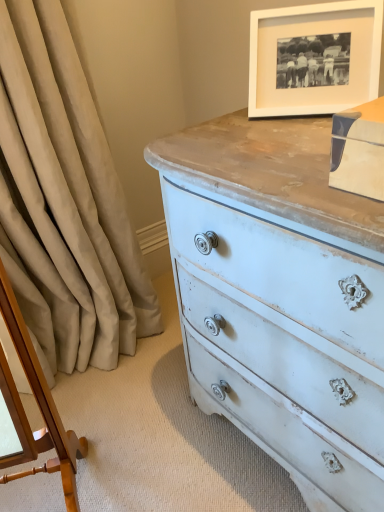
Question: Considering the relative sizes of beige fabric curtain at left and wooden changing table at left in the image provided, is beige fabric curtain at left wider than wooden changing table at left?

Choices:
 (A) no
 (B) yes

Answer: (B)

Question: Considering the relative positions of beige fabric curtain at left and wooden changing table at left in the image provided, is beige fabric curtain at left behind wooden changing table at left?

Choices:
 (A) no
 (B) yes

Answer: (B)

Question: Can you confirm if beige fabric curtain at left is positioned to the left of wooden changing table at left?

Choices:
 (A) yes
 (B) no

Answer: (B)

Question: Does beige fabric curtain at left have a greater height compared to wooden changing table at left?

Choices:
 (A) no
 (B) yes

Answer: (B)

Question: Is wooden changing table at left at the back of beige fabric curtain at left?

Choices:
 (A) no
 (B) yes

Answer: (A)

Question: In terms of width, does beige fabric curtain at left look wider or thinner when compared to wooden changing table at left?

Choices:
 (A) wide
 (B) thin

Answer: (A)

Question: From their relative heights in the image, would you say beige fabric curtain at left is taller or shorter than wooden changing table at left?

Choices:
 (A) tall
 (B) short

Answer: (A)

Question: In the image, is beige fabric curtain at left positioned in front of or behind wooden changing table at left?

Choices:
 (A) behind
 (B) front

Answer: (A)

Question: Considering the relative positions of beige fabric curtain at left and wooden changing table at left in the image provided, is beige fabric curtain at left to the left or to the right of wooden changing table at left?

Choices:
 (A) left
 (B) right

Answer: (B)

Question: Considering the positions of point (266, 25) and point (44, 406), is point (266, 25) closer or farther from the camera than point (44, 406)?

Choices:
 (A) closer
 (B) farther

Answer: (B)

Question: In the image, is white matte picture frame at upper right positioned in front of or behind wooden changing table at left?

Choices:
 (A) behind
 (B) front

Answer: (A)

Question: Considering the relative positions of white matte picture frame at upper right and wooden changing table at left in the image provided, is white matte picture frame at upper right to the left or to the right of wooden changing table at left?

Choices:
 (A) right
 (B) left

Answer: (A)

Question: Is white matte picture frame at upper right taller or shorter than wooden changing table at left?

Choices:
 (A) short
 (B) tall

Answer: (A)

Question: Would you say beige fabric curtain at left is to the left or to the right of white matte picture frame at upper right in the picture?

Choices:
 (A) left
 (B) right

Answer: (A)

Question: Based on their sizes in the image, would you say beige fabric curtain at left is bigger or smaller than white matte picture frame at upper right?

Choices:
 (A) big
 (B) small

Answer: (A)